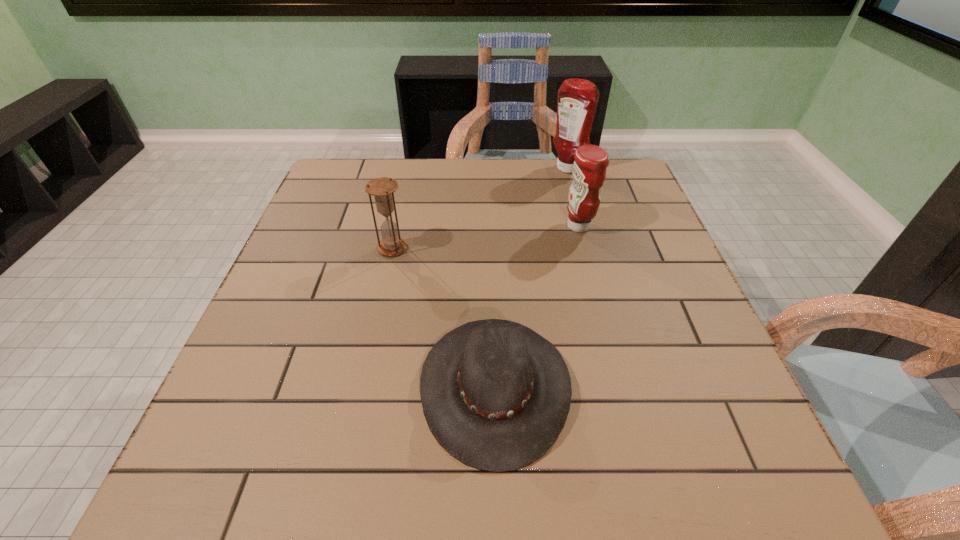
This screenshot has height=540, width=960. In order to click on the farther condiment in this screenshot , I will do `click(577, 98)`.

At what (x,y) coordinates should I click in order to perform the action: click on the tallest object. Please return your answer as a coordinate pair (x, y). This screenshot has width=960, height=540. Looking at the image, I should click on (577, 98).

Locate an element on the screen. This screenshot has width=960, height=540. the nearer condiment is located at coordinates (589, 169).

Identify the location of the leftmost object. (383, 188).

The height and width of the screenshot is (540, 960). I want to click on the second shortest object, so click(x=383, y=188).

Where is `the second object from left to right`? the second object from left to right is located at coordinates (495, 394).

Locate an element on the screen. hat is located at coordinates (495, 394).

Find the location of `free space located 0.150m on the front of the farthest object`. free space located 0.150m on the front of the farthest object is located at coordinates (578, 207).

At what (x,y) coordinates should I click in order to perform the action: click on blank area located on the back of the nearer condiment. Please return your answer as a coordinate pair (x, y). This screenshot has width=960, height=540. Looking at the image, I should click on (562, 161).

This screenshot has width=960, height=540. In order to click on blank space located 0.250m on the back of the third tallest object in this screenshot , I will do `click(407, 184)`.